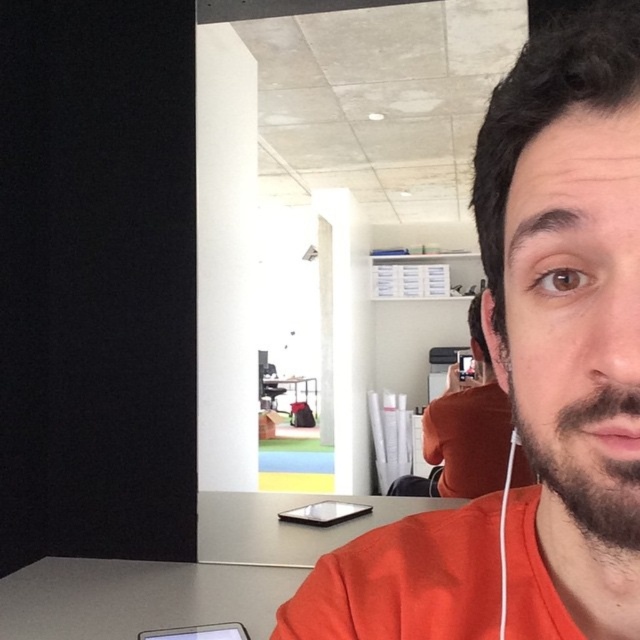
Measure the distance between point (470, 481) and camera.

Point (470, 481) and camera are 7.47 feet apart.

Is orange matte shirt at right shorter than matte black table at center?

No, orange matte shirt at right is not shorter than matte black table at center.

Which is in front, point (477, 445) or point (314, 387)?

Point (477, 445) is in front.

Identify the location of orange matte shirt at right. This screenshot has height=640, width=640. (468, 426).

Is gray matte table at lower left to the right of brownbeard at right from the viewer's perspective?

Incorrect, gray matte table at lower left is not on the right side of brownbeard at right.

This screenshot has width=640, height=640. What do you see at coordinates (138, 596) in the screenshot?
I see `gray matte table at lower left` at bounding box center [138, 596].

Where is `gray matte table at lower left`? Image resolution: width=640 pixels, height=640 pixels. gray matte table at lower left is located at coordinates (138, 596).

Can you confirm if gray matte table at lower left is smaller than orange matte shirt at right?

Correct, gray matte table at lower left occupies less space than orange matte shirt at right.

Which is behind, point (102, 605) or point (456, 456)?

The point (456, 456) is more distant.

The image size is (640, 640). Describe the element at coordinates (138, 596) in the screenshot. I see `gray matte table at lower left` at that location.

At what (x,y) coordinates should I click in order to perform the action: click on gray matte table at lower left. Please return your answer as a coordinate pair (x, y). Looking at the image, I should click on (138, 596).